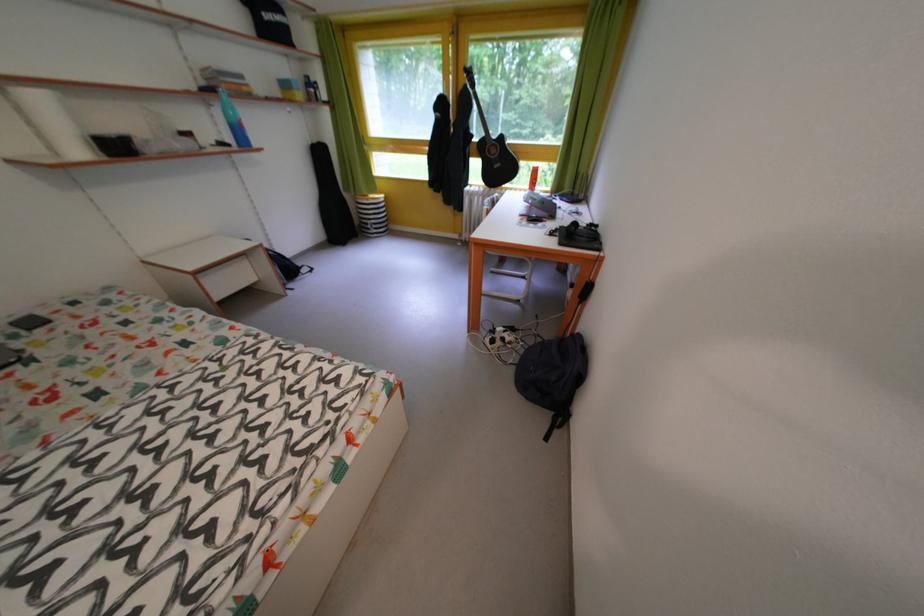
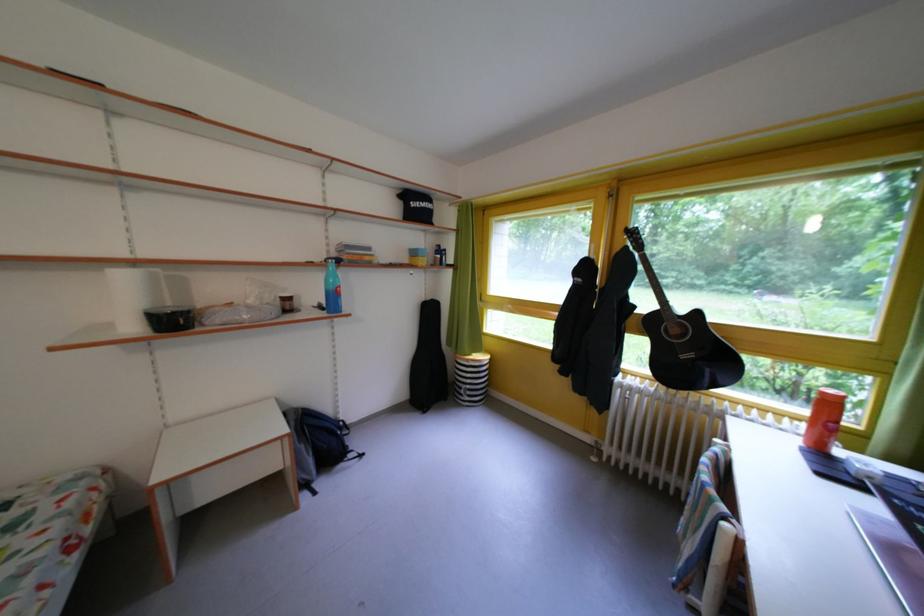
Where in the second image is the point corresponding to [383,227] from the first image?

(478, 392)